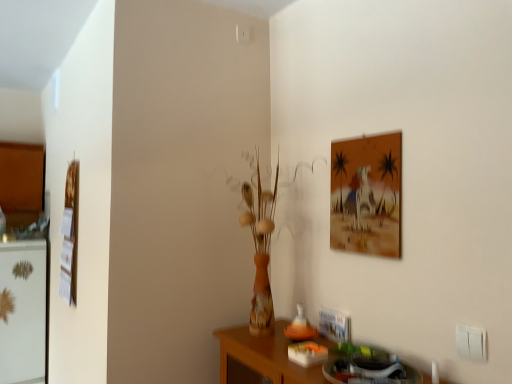
In order to face white glossy fridge at left, should I rotate leftwards or rightwards?

Rotate your view left by about 29.028°.

The image size is (512, 384). I want to click on white plastic electric outlet at lower right, so click(471, 342).

Locate an element on the screen. This screenshot has width=512, height=384. wooden picture frame at left, marked as the first picture frame in a left-to-right arrangement is located at coordinates (70, 235).

Image resolution: width=512 pixels, height=384 pixels. What do you see at coordinates (70, 235) in the screenshot?
I see `wooden picture frame at left, the 2th picture frame in the right-to-left sequence` at bounding box center [70, 235].

This screenshot has width=512, height=384. I want to click on white glossy fridge at left, so click(23, 311).

What's the angular difference between white glossy fridge at left and white plastic electric outlet at lower right's facing directions?

90 degrees.

Does point (33, 368) come closer to viewer compared to point (460, 350)?

No.

Is white glossy fridge at left looking in the opposite direction of white plastic electric outlet at lower right?

No, white plastic electric outlet at lower right is not at the back of white glossy fridge at left.

The width and height of the screenshot is (512, 384). I want to click on electric outlet in front of the white glossy fridge at left, so click(x=471, y=342).

Between wooden picture frame at left, placed as the 2th picture frame when sorted from front to back, and matte orange painting at upper right, acting as the 1th picture frame starting from the right, which one has more height?

wooden picture frame at left, placed as the 2th picture frame when sorted from front to back, is taller.

Does wooden picture frame at left, marked as the first picture frame in a left-to-right arrangement, have a greater width compared to matte orange painting at upper right, which is the second picture frame from left to right?

Indeed, wooden picture frame at left, marked as the first picture frame in a left-to-right arrangement, has a greater width compared to matte orange painting at upper right, which is the second picture frame from left to right.

Can you tell me how much wooden picture frame at left, positioned as the first picture frame in back-to-front order, and matte orange painting at upper right, which is the second picture frame from left to right, differ in facing direction?

The facing directions of wooden picture frame at left, positioned as the first picture frame in back-to-front order, and matte orange painting at upper right, which is the second picture frame from left to right, are 0.00405 degrees apart.

Considering the points (75, 179) and (358, 203), which point is in front, point (75, 179) or point (358, 203)?

Positioned in front is point (358, 203).

Does white plastic electric outlet at lower right appear on the right side of white glossy fridge at left?

Correct, you'll find white plastic electric outlet at lower right to the right of white glossy fridge at left.

Is white plastic electric outlet at lower right wider or thinner than white glossy fridge at left?

Considering their sizes, white plastic electric outlet at lower right looks slimmer than white glossy fridge at left.

From a real-world perspective, is white plastic electric outlet at lower right located beneath white glossy fridge at left?

Incorrect, from a real-world perspective, white plastic electric outlet at lower right is higher than white glossy fridge at left.

Is white plastic electric outlet at lower right positioned with its back to white glossy fridge at left?

No, white plastic electric outlet at lower right's orientation is not away from white glossy fridge at left.

Is matte orange painting at upper right, acting as the 1th picture frame starting from the right, far away from white plastic electric outlet at lower right?

No, matte orange painting at upper right, acting as the 1th picture frame starting from the right, is not far from white plastic electric outlet at lower right.

From a real-world perspective, which is physically below, matte orange painting at upper right, which appears as the second picture frame when viewed from the back, or white plastic electric outlet at lower right?

white plastic electric outlet at lower right is physically lower.

How many degrees apart are the facing directions of matte orange painting at upper right, acting as the 1th picture frame starting from the right, and white plastic electric outlet at lower right?

matte orange painting at upper right, acting as the 1th picture frame starting from the right, and white plastic electric outlet at lower right are facing 0.00172 degrees away from each other.

Between matte orange painting at upper right, acting as the 1th picture frame starting from the right, and white plastic electric outlet at lower right, which one has less height?

With less height is white plastic electric outlet at lower right.

Are wooden picture frame at left, placed as the 2th picture frame when sorted from front to back, and white plastic electric outlet at lower right beside each other?

No, wooden picture frame at left, placed as the 2th picture frame when sorted from front to back, is not next to white plastic electric outlet at lower right.

Who is more distant, wooden picture frame at left, placed as the 2th picture frame when sorted from front to back, or white plastic electric outlet at lower right?

wooden picture frame at left, placed as the 2th picture frame when sorted from front to back, is further from the camera.

Can you tell me how much wooden picture frame at left, marked as the first picture frame in a left-to-right arrangement, and white plastic electric outlet at lower right differ in facing direction?

0.00575 degrees.

Is wooden picture frame at left, marked as the first picture frame in a left-to-right arrangement, inside the boundaries of white plastic electric outlet at lower right, or outside?

wooden picture frame at left, marked as the first picture frame in a left-to-right arrangement, cannot be found inside white plastic electric outlet at lower right.

From a real-world perspective, is wooden picture frame at left, placed as the 2th picture frame when sorted from front to back, positioned over white glossy fridge at left based on gravity?

Yes, from a real-world perspective, wooden picture frame at left, placed as the 2th picture frame when sorted from front to back, is on top of white glossy fridge at left.

Is point (70, 240) farther from viewer compared to point (37, 258)?

No, it is not.

Between wooden picture frame at left, placed as the 2th picture frame when sorted from front to back, and white glossy fridge at left, which one has larger width?

white glossy fridge at left.

This screenshot has width=512, height=384. In order to click on fridge that is under the wooden picture frame at left, the 2th picture frame in the right-to-left sequence (from a real-world perspective) in this screenshot , I will do `click(23, 311)`.

From a real-world perspective, which is physically above, white glossy fridge at left or matte orange painting at upper right, the 1th picture frame when ordered from front to back?

From a 3D spatial view, matte orange painting at upper right, the 1th picture frame when ordered from front to back, is above.

Between white glossy fridge at left and matte orange painting at upper right, acting as the 1th picture frame starting from the right, which one has smaller size?

matte orange painting at upper right, acting as the 1th picture frame starting from the right.

Is white glossy fridge at left aimed at matte orange painting at upper right, the 1th picture frame when ordered from front to back?

No, white glossy fridge at left does not turn towards matte orange painting at upper right, the 1th picture frame when ordered from front to back.

You are a GUI agent. You are given a task and a screenshot of the screen. Output one action in this format:
    pyautogui.click(x=<x>, y=<y>)
    Task: Click on the fridge below the white plastic electric outlet at lower right (from a real-world perspective)
    This screenshot has height=384, width=512.
    Given the screenshot: What is the action you would take?
    pyautogui.click(x=23, y=311)

The width and height of the screenshot is (512, 384). Find the location of `picture frame behind the matte orange painting at upper right, which appears as the second picture frame when viewed from the back`. picture frame behind the matte orange painting at upper right, which appears as the second picture frame when viewed from the back is located at coordinates (70, 235).

Looking at the image, which one is located closer to white plastic electric outlet at lower right, matte orange painting at upper right, which appears as the second picture frame when viewed from the back, or wooden picture frame at left, the 2th picture frame in the right-to-left sequence?

The object closer to white plastic electric outlet at lower right is matte orange painting at upper right, which appears as the second picture frame when viewed from the back.

From the image, which object appears to be farther from matte orange painting at upper right, which is the second picture frame from left to right, wooden picture frame at left, positioned as the first picture frame in back-to-front order, or white glossy fridge at left?

The object further to matte orange painting at upper right, which is the second picture frame from left to right, is white glossy fridge at left.

Looking at the image, which one is located further to white glossy fridge at left, matte orange painting at upper right, the 1th picture frame when ordered from front to back, or white plastic electric outlet at lower right?

The object further to white glossy fridge at left is white plastic electric outlet at lower right.

Which object lies further to the anchor point wooden picture frame at left, marked as the first picture frame in a left-to-right arrangement, white plastic electric outlet at lower right or white glossy fridge at left?

Based on the image, white plastic electric outlet at lower right appears to be further to wooden picture frame at left, marked as the first picture frame in a left-to-right arrangement.

Looking at the image, which one is located further to matte orange painting at upper right, which is the second picture frame from left to right, white plastic electric outlet at lower right or white glossy fridge at left?

white glossy fridge at left.

Estimate the real-world distances between objects in this image. Which object is further from wooden picture frame at left, the 2th picture frame in the right-to-left sequence, white glossy fridge at left or white plastic electric outlet at lower right?

Based on the image, white plastic electric outlet at lower right appears to be further to wooden picture frame at left, the 2th picture frame in the right-to-left sequence.

Estimate the real-world distances between objects in this image. Which object is further from white glossy fridge at left, wooden picture frame at left, positioned as the first picture frame in back-to-front order, or white plastic electric outlet at lower right?

white plastic electric outlet at lower right.

Based on their spatial positions, is white plastic electric outlet at lower right or matte orange painting at upper right, which is the second picture frame from left to right, further from white glossy fridge at left?

white plastic electric outlet at lower right is further to white glossy fridge at left.

I want to click on picture frame between white glossy fridge at left and matte orange painting at upper right, the 1th picture frame when ordered from front to back, from left to right, so click(70, 235).

Find the location of a particular element. The image size is (512, 384). picture frame between wooden picture frame at left, placed as the 2th picture frame when sorted from front to back, and white plastic electric outlet at lower right from left to right is located at coordinates (367, 195).